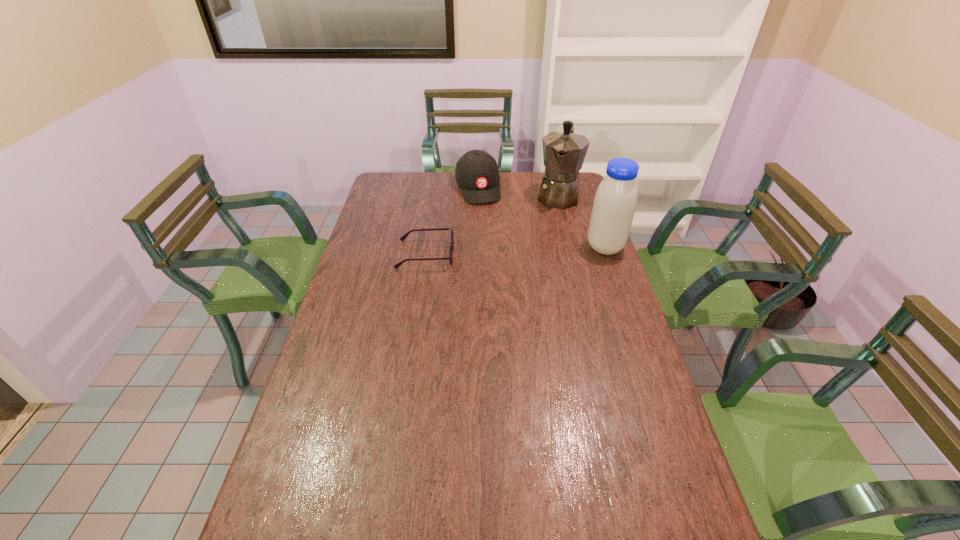
Find the location of `spectacles`. spectacles is located at coordinates pyautogui.click(x=403, y=237).

At what (x,y) coordinates should I click in order to perform the action: click on soya milk. Please return your answer as a coordinate pair (x, y). This screenshot has width=960, height=540. Looking at the image, I should click on (615, 201).

You are a GUI agent. You are given a task and a screenshot of the screen. Output one action in this format:
    pyautogui.click(x=<x>, y=<y>)
    Task: Click on the coffeepot
    The height and width of the screenshot is (540, 960).
    Given the screenshot: What is the action you would take?
    pyautogui.click(x=564, y=152)

Locate an element on the screen. baseball cap is located at coordinates (477, 175).

Identify the location of free region located on the front-facing side of the shortest object. (472, 255).

Identify the location of vacant space located on the front of the soya milk. (619, 287).

At what (x,y) coordinates should I click in order to perform the action: click on free spot located on the pouring side of the coffeepot. Please return your answer as a coordinate pair (x, y). This screenshot has width=960, height=540. Looking at the image, I should click on (540, 273).

I want to click on vacant space situated 0.280m on the pouring side of the coffeepot, so click(545, 253).

This screenshot has height=540, width=960. Identify the location of vacant area located 0.220m on the pouring side of the coffeepot. (548, 244).

The width and height of the screenshot is (960, 540). Identify the location of vacant space located 0.060m with a logo on the front of the third tallest object. (485, 213).